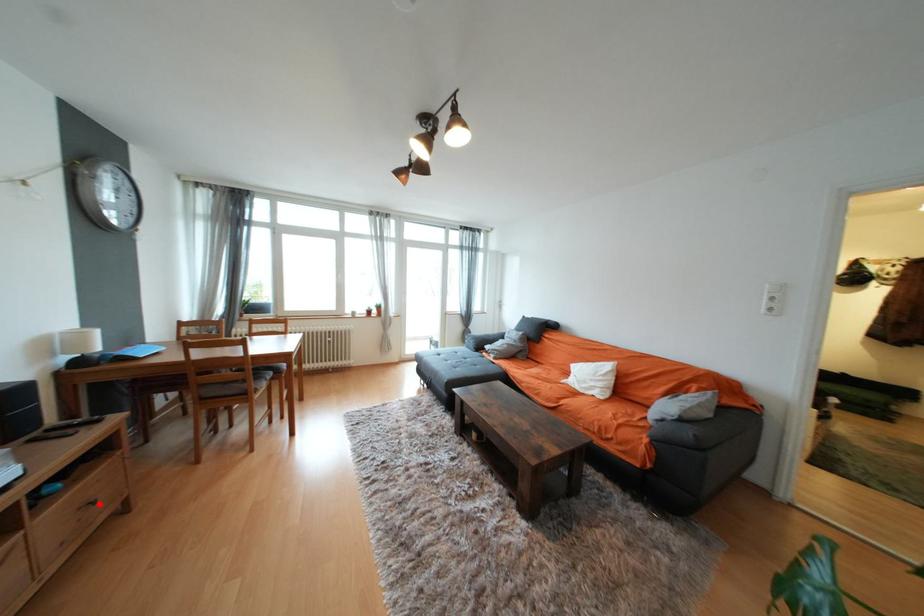
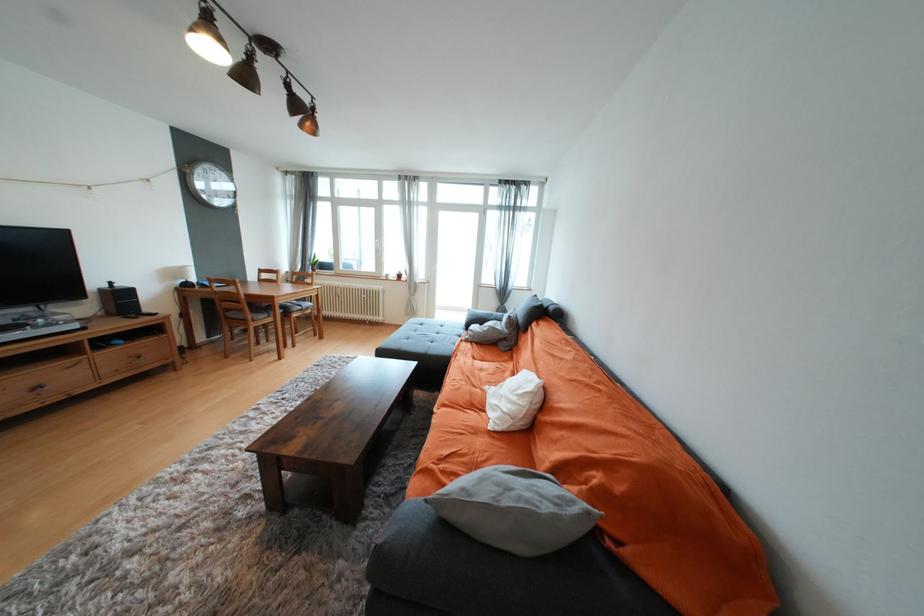
Question: I am providing you with two images of the same scene from different viewpoints. A red point is shown in image1. For the corresponding object point in image2, is it positioned nearer or farther from the camera?

Choices:
 (A) Nearer
 (B) Farther

Answer: (B)